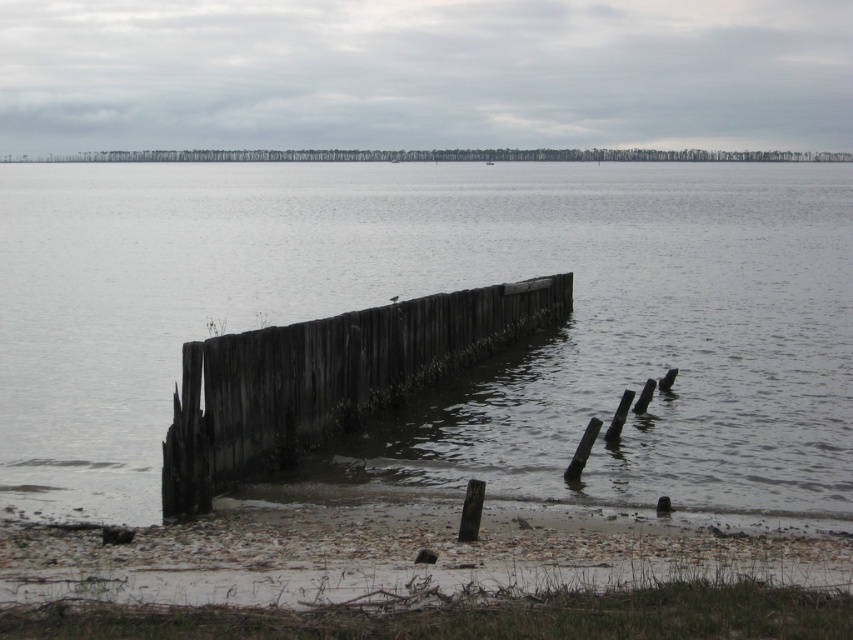
You are standing at the smooth sand shoreline at lower center and want to reach the weathered wood dock at center. Which direction should you move to get closer to the dock?

The smooth sand shoreline at lower center has a smaller size compared to the weathered wood dock at center. Since the shoreline is smaller, you should move towards the center of the image to reach the dock.

You are a small crab trying to cross from the shoreline to the weathered wood dock at center. The smooth sand shoreline at lower center is your only path. Can you safely cross using the sand shoreline? Explain why or why not based on its width compared to the dock.

The smooth sand shoreline at lower center is thinner than the weathered wood dock at center, so the sand shoreline is narrower. Since the crab is small, it can safely cross the narrower path as it requires less width.

You are standing on the shore and want to cross to the other side of the weathered wood dock at center. The dock is made of weathered wood and is surrounded by weathered wood water at center. Since the dock is narrower than the water, can you safely walk across the dock to reach the other side?

The weathered wood water at center is wider than the weathered wood dock at center, so the dock is narrower. However, the dock itself is still a solid structure made of weathered wood, so you can safely walk across the weathered wood dock at center to reach the other side.